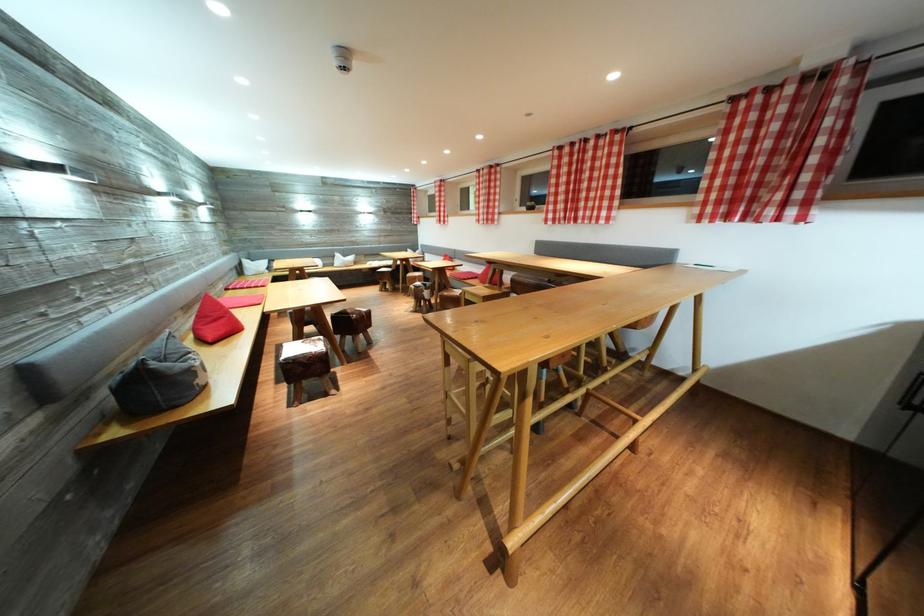
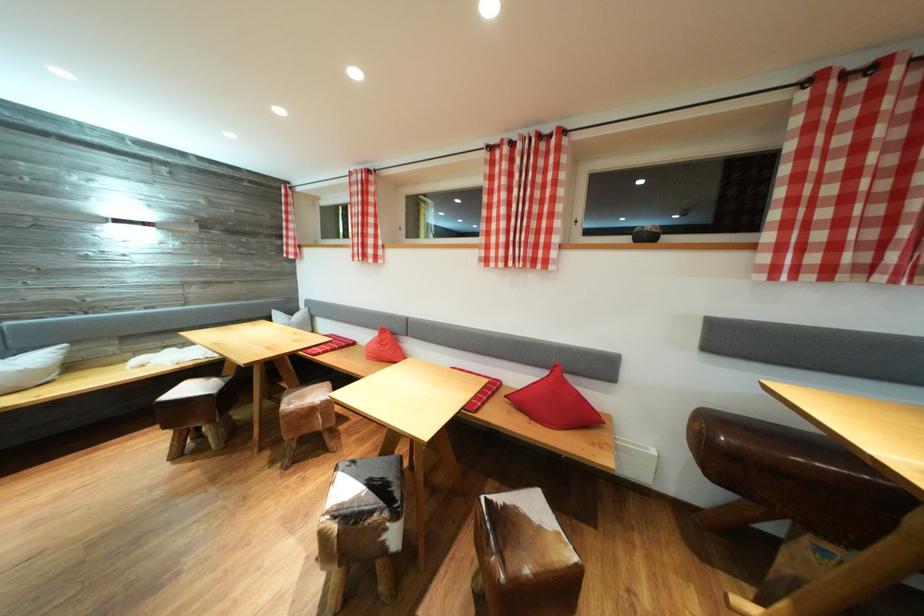
The point at [433,294] is marked in the first image. Where is the corresponding point in the second image?

(403, 522)